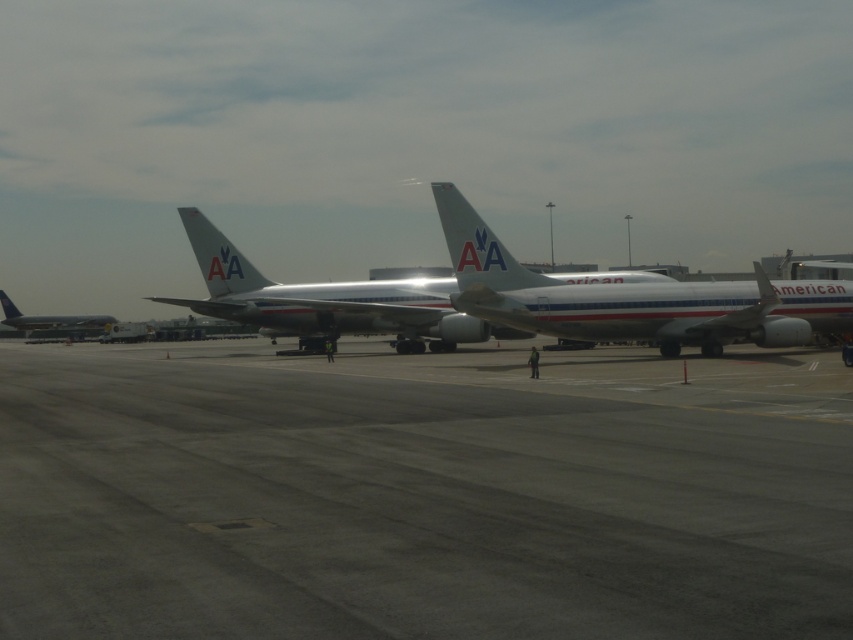
You are a ground crew member tasked with guiding an aircraft to park. You see the white metallic airplane at center and the silver metallic airplane at center. Which airplane should you direct to move first if you need to make space for a larger aircraft arriving shortly?

The white metallic airplane at center is smaller than the silver metallic airplane at center. Since the arriving aircraft is larger, the silver metallic airplane at center would require more space, so it should move first to accommodate the larger aircraft.

You are a pilot approaching the airport and need to land your plane. You see the gray asphalt runway at center and the metallic silver airplane at left. Which direction should you adjust your course to align with the runway?

You should adjust your course to the right to align with the gray asphalt runway at center since it is positioned to the right of the metallic silver airplane at left.